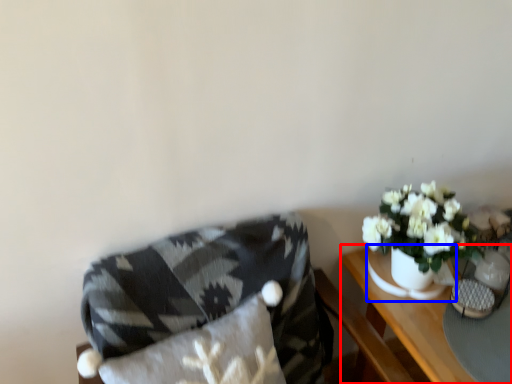
Question: Which point is closer to the camera, table (highlighted by a red box) or vase (highlighted by a blue box)?

Choices:
 (A) table
 (B) vase

Answer: (A)